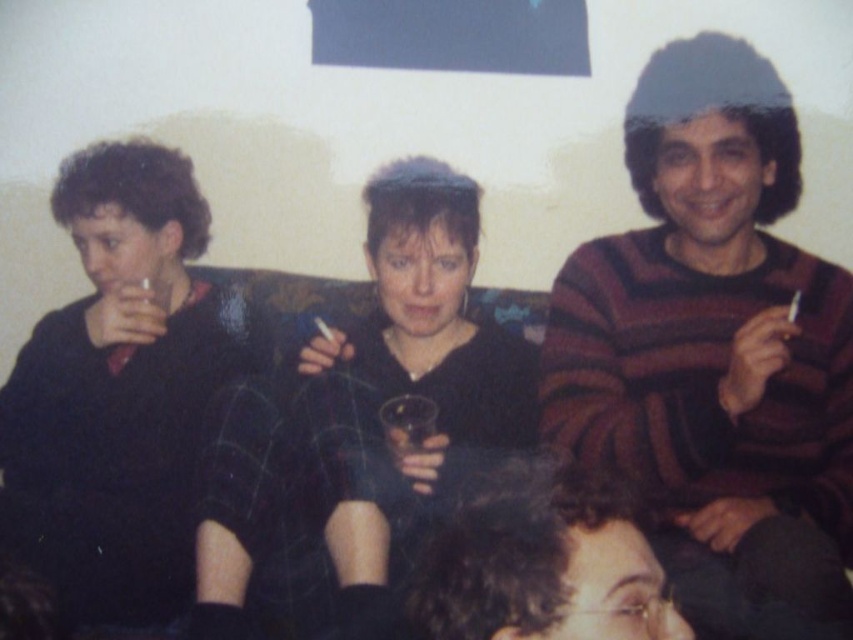
You are a fashion designer observing the three people in the living room. You need to determine which of the two sweaters, the black matte sweater at center or the matte black sweater at left, is narrower. Which one is it?

The black matte sweater at center has a lesser width compared to the matte black sweater at left, so the black matte sweater at center is narrower.

You are a photographer trying to capture a candid shot of the dark curly hair at lower center and the striped sweater at right. Your camera has a maximum focus range of 70 centimeters. Can you take a photo of both subjects without moving your position?

The distance between the striped sweater at right and dark curly hair at lower center is 69.68 centimeters, which is within the camera maximum focus range of 70 centimeters. Therefore, you can take a photo of both subjects without moving your position.

You are a photographer setting up a shot of the striped sweater at right and the dark curly hair at lower center. Which object should you focus on first to ensure both are in sharp focus?

The striped sweater at right is closer to you than the dark curly hair at lower center, so focus on the striped sweater at right first to ensure both are in sharp focus.